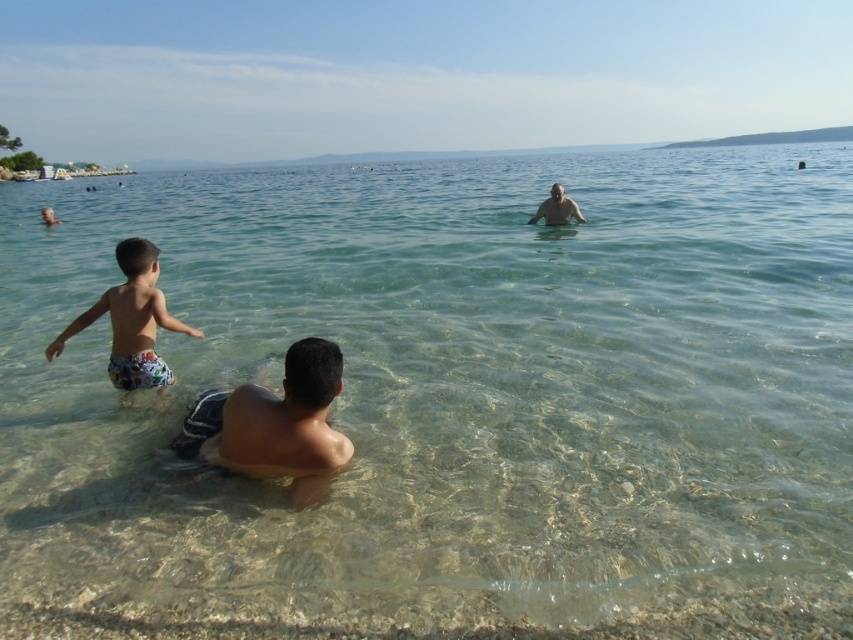
Between printed swim trunks at left and smooth skin man at upper center, which one appears on the left side from the viewer's perspective?

printed swim trunks at left

Does printed swim trunks at left appear on the left side of smooth skin man at upper center?

Yes, printed swim trunks at left is to the left of smooth skin man at upper center.

Is point (151, 317) positioned behind point (564, 211)?

No.

Find the location of `printed swim trunks at left`. printed swim trunks at left is located at coordinates (131, 321).

From the picture: Is the position of light brown skin at center less distant than that of smooth skin man at upper center?

Yes.

Is point (280, 445) in front of point (582, 216)?

Yes, it is.

You are a GUI agent. You are given a task and a screenshot of the screen. Output one action in this format:
    pyautogui.click(x=<x>, y=<y>)
    Task: Click on the light brown skin at center
    This screenshot has width=853, height=640.
    Given the screenshot: What is the action you would take?
    pyautogui.click(x=276, y=424)

Is light brown skin at center below printed swim trunks at left?

Yes.

In the scene shown: Can you confirm if light brown skin at center is shorter than printed swim trunks at left?

Yes.

Between point (184, 417) and point (131, 369), which one is positioned in front?

Point (184, 417) is more forward.

You are a GUI agent. You are given a task and a screenshot of the screen. Output one action in this format:
    pyautogui.click(x=<x>, y=<y>)
    Task: Click on the light brown skin at center
    Image resolution: width=853 pixels, height=640 pixels.
    Given the screenshot: What is the action you would take?
    pyautogui.click(x=276, y=424)